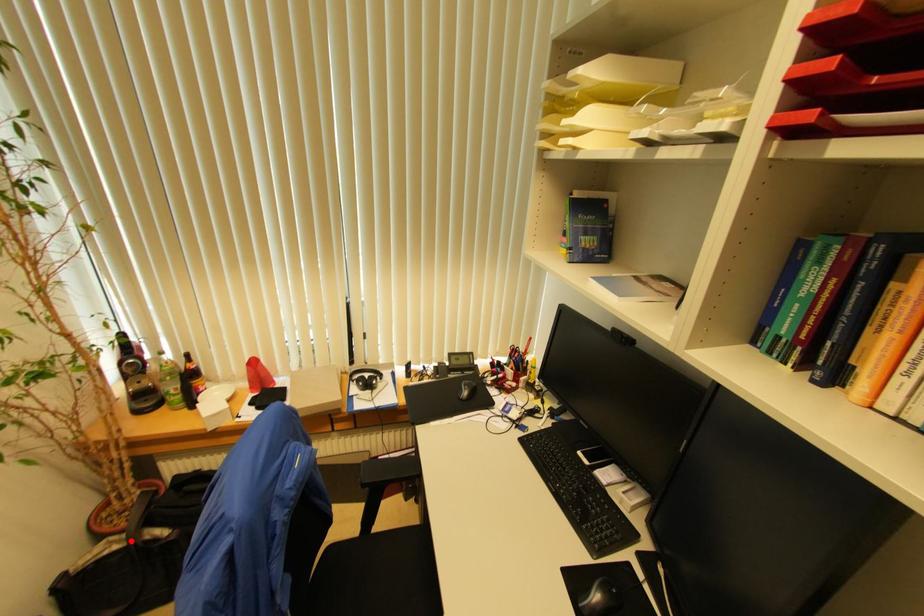
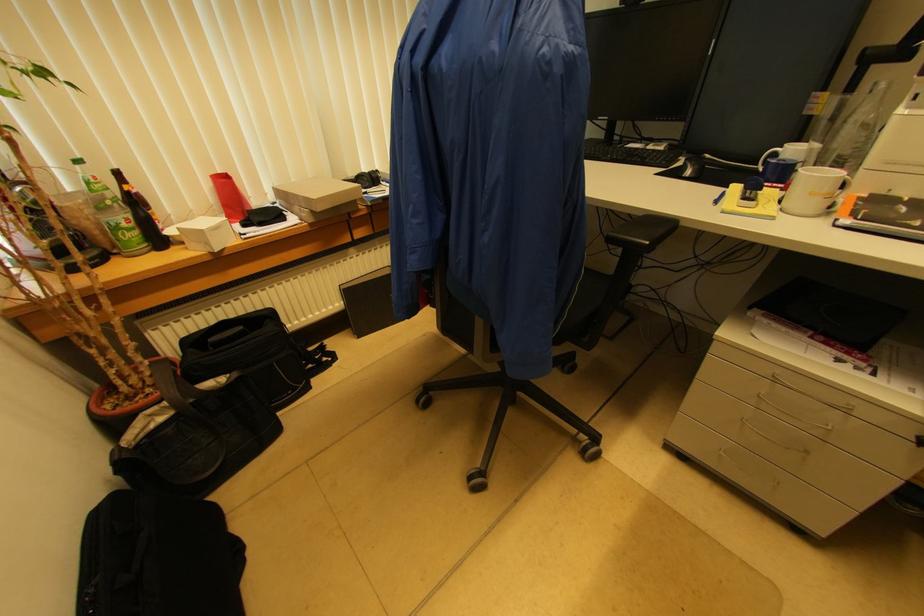
Question: I am providing you with two images of the same scene from different viewpoints. A red point is marked on the first image. At the location where the point appears in image 1, is it still visible in image 2?

Choices:
 (A) Yes
 (B) No

Answer: (A)